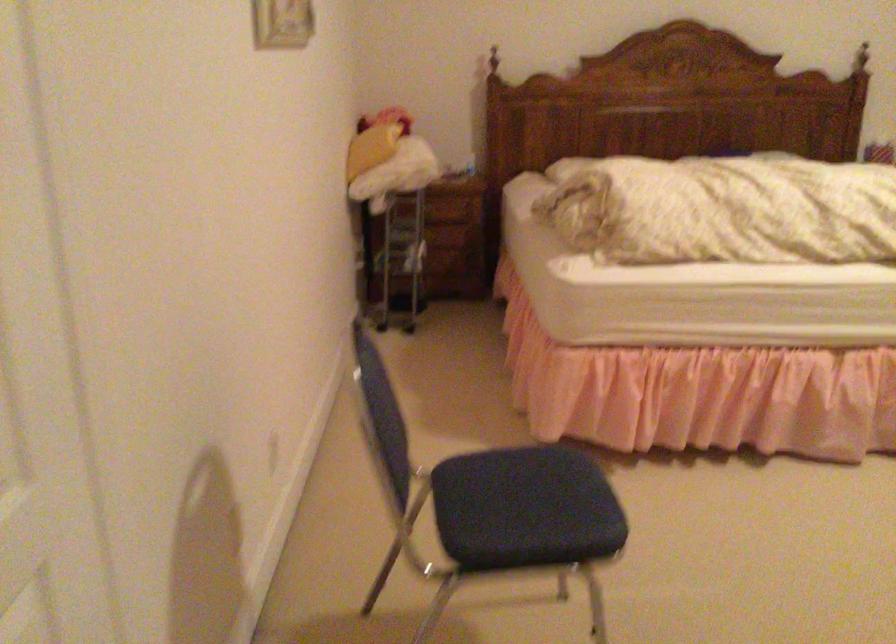
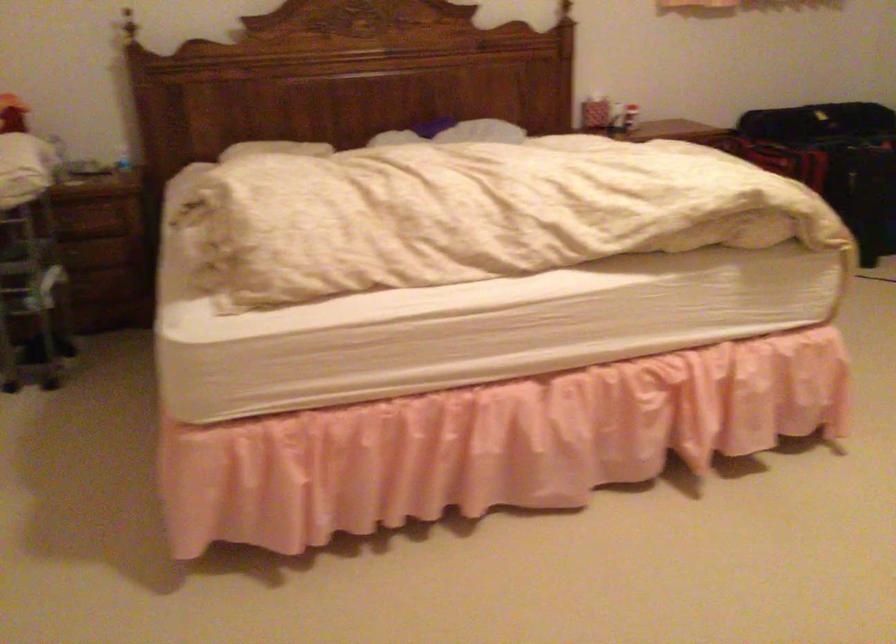
Question: The camera is either moving clockwise (left) or counter-clockwise (right) around the object. The first image is from the beginning of the video and the second image is from the end. Is the camera moving left or right when shooting the video?

Choices:
 (A) Left
 (B) Right

Answer: (A)